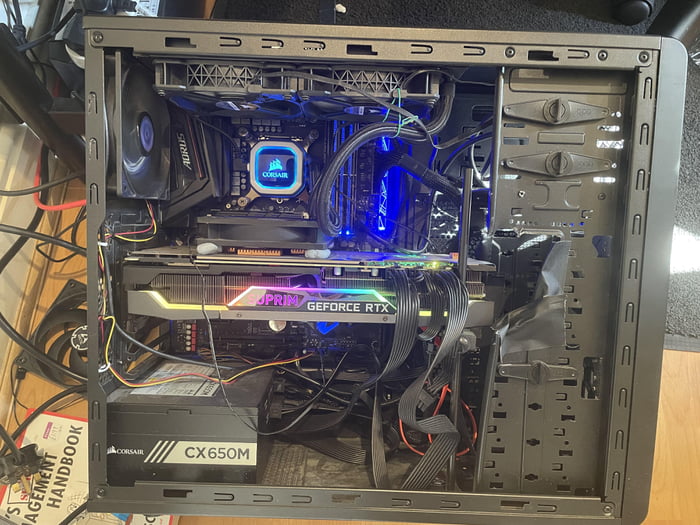
Where is `wood floor`? wood floor is located at coordinates (41, 390).